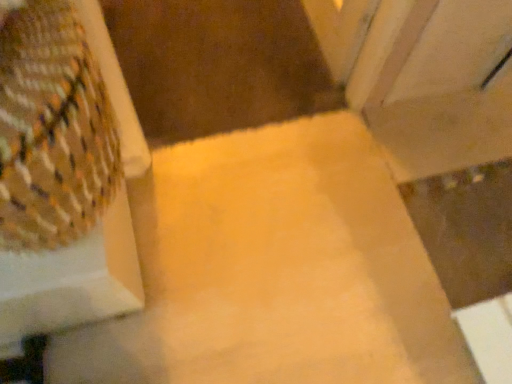
Measure the distance between point (21, 197) and camera.

They are 20.87 inches apart.

Where is `woven fabric curtain at left`? The height and width of the screenshot is (384, 512). woven fabric curtain at left is located at coordinates (52, 130).

This screenshot has width=512, height=384. What do you see at coordinates (52, 130) in the screenshot?
I see `woven fabric curtain at left` at bounding box center [52, 130].

At what (x,y) coordinates should I click in order to perform the action: click on woven fabric curtain at left. Please return your answer as a coordinate pair (x, y). Looking at the image, I should click on (52, 130).